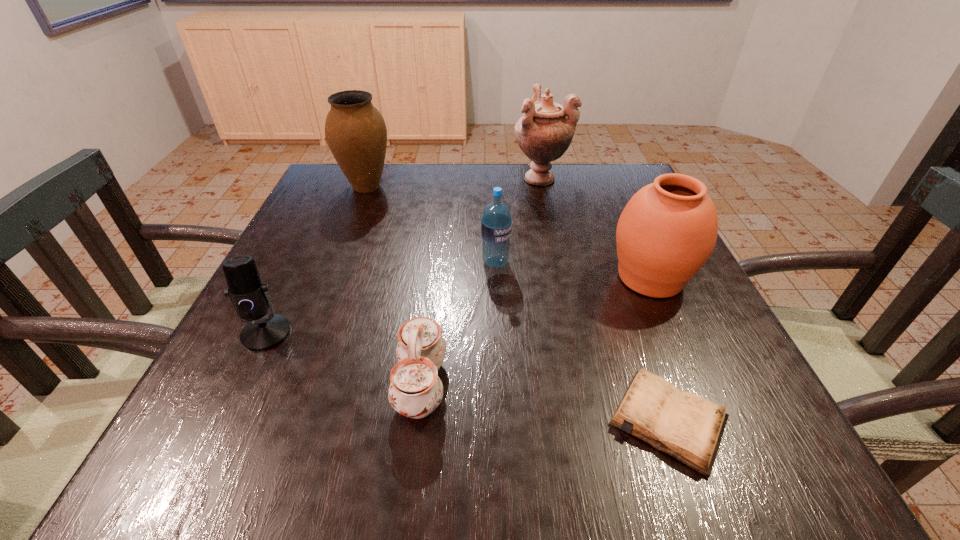
Find the location of a particular element. free spot between the leftmost urn and the sixth tallest object is located at coordinates (394, 286).

What are the coordinates of `vacant space that is in between the second urn from left to right and the nearest urn` in the screenshot? It's located at (595, 227).

Identify the location of vacant space in between the leftmost urn and the microphone. The image size is (960, 540). (316, 260).

Locate an element on the screen. The image size is (960, 540). free space between the second urn from right to left and the water bottle is located at coordinates (518, 220).

This screenshot has height=540, width=960. What are the coordinates of `vacant area that lies between the fourth object from right to left and the microphone` in the screenshot? It's located at (381, 298).

Find the location of a particular element. The height and width of the screenshot is (540, 960). empty location between the second urn from right to left and the diary is located at coordinates (605, 299).

Identify the location of vacant point located between the rightmost urn and the third object from left to right. Image resolution: width=960 pixels, height=540 pixels. click(536, 331).

Where is `free space between the water bottle and the microphone`? The width and height of the screenshot is (960, 540). free space between the water bottle and the microphone is located at coordinates (381, 298).

Locate an element on the screen. This screenshot has width=960, height=540. object that stands as the fifth closest to the shortest object is located at coordinates (545, 131).

Locate which object ranks second in proximity to the shortest object. Please provide its 2D coordinates. Your answer should be formatted as a tuple, i.e. [(x, y)], where the tuple contains the x and y coordinates of a point satisfying the conditions above.

[(415, 391)]